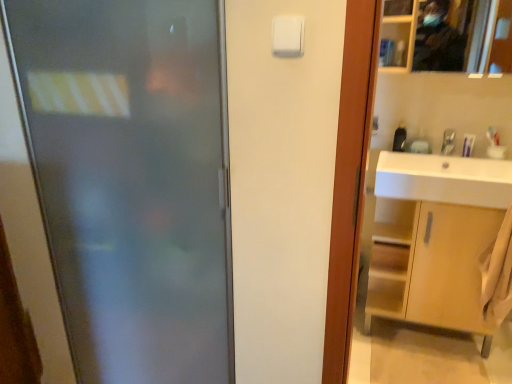
Question: Is silver metallic faucet at upper right positioned beyond the bounds of frosted glass door at left?

Choices:
 (A) yes
 (B) no

Answer: (A)

Question: From a real-world perspective, does silver metallic faucet at upper right stand above frosted glass door at left?

Choices:
 (A) no
 (B) yes

Answer: (B)

Question: Is silver metallic faucet at upper right closer to camera compared to frosted glass door at left?

Choices:
 (A) yes
 (B) no

Answer: (B)

Question: Can you confirm if silver metallic faucet at upper right is taller than frosted glass door at left?

Choices:
 (A) no
 (B) yes

Answer: (A)

Question: Is silver metallic faucet at upper right wider than frosted glass door at left?

Choices:
 (A) no
 (B) yes

Answer: (A)

Question: Is silver metallic faucet at upper right inside the boundaries of frosted glass door at left, or outside?

Choices:
 (A) inside
 (B) outside

Answer: (B)

Question: Would you say silver metallic faucet at upper right is to the left or to the right of frosted glass door at left in the picture?

Choices:
 (A) left
 (B) right

Answer: (B)

Question: Looking at their shapes, would you say silver metallic faucet at upper right is wider or thinner than frosted glass door at left?

Choices:
 (A) thin
 (B) wide

Answer: (A)

Question: Based on their sizes in the image, would you say silver metallic faucet at upper right is bigger or smaller than frosted glass door at left?

Choices:
 (A) small
 (B) big

Answer: (A)

Question: Relative to white glossy sink at right, is metallic reflective mirror at upper right in front or behind?

Choices:
 (A) front
 (B) behind

Answer: (A)

Question: From the image's perspective, is metallic reflective mirror at upper right located above or below white glossy sink at right?

Choices:
 (A) below
 (B) above

Answer: (B)

Question: From a real-world perspective, is metallic reflective mirror at upper right above or below white glossy sink at right?

Choices:
 (A) below
 (B) above

Answer: (B)

Question: In terms of width, does metallic reflective mirror at upper right look wider or thinner when compared to white glossy sink at right?

Choices:
 (A) wide
 (B) thin

Answer: (B)

Question: In the image, is silver metallic faucet at upper right positioned in front of or behind white plastic light switch at upper center?

Choices:
 (A) front
 (B) behind

Answer: (B)

Question: Considering the positions of silver metallic faucet at upper right and white plastic light switch at upper center in the image, is silver metallic faucet at upper right wider or thinner than white plastic light switch at upper center?

Choices:
 (A) wide
 (B) thin

Answer: (A)